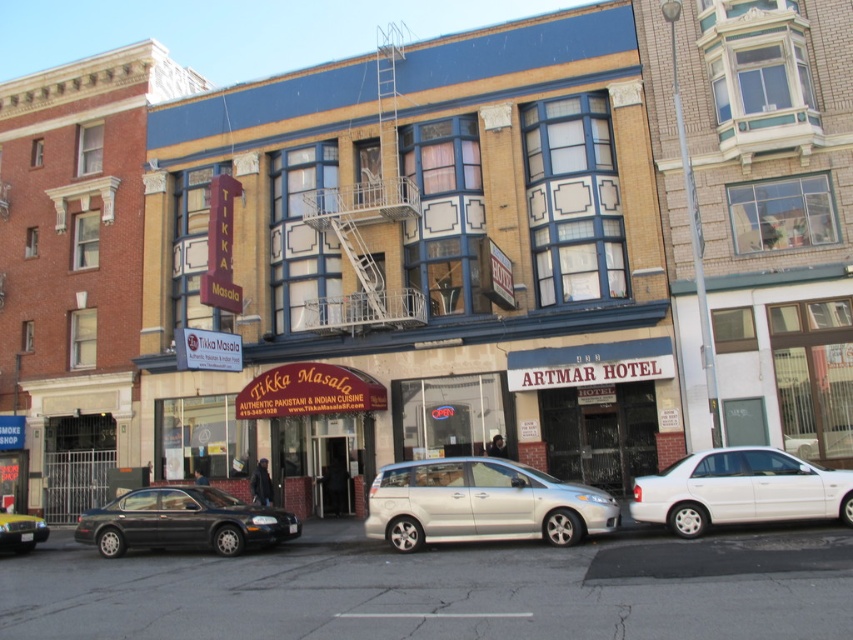
You are a delivery driver who needs to park your van next to the shiny black sedan at lower left. However, there is a maroon fabric signboard at center hanging above the parking spot. Can you safely park your van there without hitting the signboard?

The maroon fabric signboard at center is positioned over the shiny black sedan at lower left, meaning the signboard is directly above the parking spot where the shiny black sedan is parked. Parking your van there might risk hitting the signboard, so it is not safe to park there.

You are a delivery person who needs to park your 2.5 meter wide truck between the silver metallic minivan at center and the white glossy sedan at lower right. Can you fit your truck there?

The silver metallic minivan at center is further to the viewer than the white glossy sedan at lower right, so the distance between them may vary. However, without specific measurements of the space between them, it is impossible to determine if the truck will fit. Please check the actual space before attempting to park.